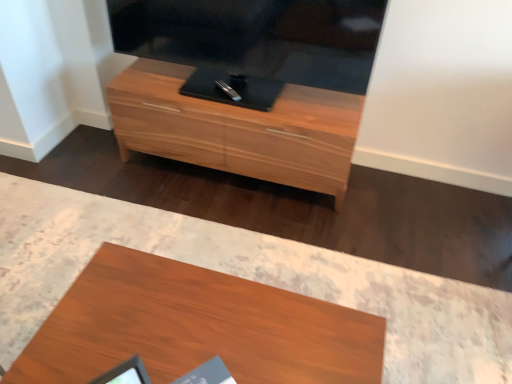
Question: Can you confirm if wooden chest of drawers at center is taller than wooden desk at center?

Choices:
 (A) yes
 (B) no

Answer: (A)

Question: Is wooden chest of drawers at center far from wooden desk at center?

Choices:
 (A) yes
 (B) no

Answer: (B)

Question: Considering the relative sizes of wooden chest of drawers at center and wooden desk at center in the image provided, is wooden chest of drawers at center wider than wooden desk at center?

Choices:
 (A) yes
 (B) no

Answer: (B)

Question: Could you tell me if wooden chest of drawers at center is turned towards wooden desk at center?

Choices:
 (A) no
 (B) yes

Answer: (B)

Question: Is wooden chest of drawers at center at the right side of wooden desk at center?

Choices:
 (A) no
 (B) yes

Answer: (B)

Question: Is wooden chest of drawers at center placed right next to wooden desk at center?

Choices:
 (A) no
 (B) yes

Answer: (A)

Question: Considering the relative sizes of wooden desk at center and wooden chest of drawers at center in the image provided, is wooden desk at center shorter than wooden chest of drawers at center?

Choices:
 (A) yes
 (B) no

Answer: (A)

Question: Can you confirm if wooden desk at center is taller than wooden chest of drawers at center?

Choices:
 (A) no
 (B) yes

Answer: (A)

Question: Is wooden desk at center behind wooden chest of drawers at center?

Choices:
 (A) no
 (B) yes

Answer: (A)

Question: Is wooden desk at center at the left side of wooden chest of drawers at center?

Choices:
 (A) yes
 (B) no

Answer: (A)

Question: Considering the relative sizes of wooden desk at center and wooden chest of drawers at center in the image provided, is wooden desk at center smaller than wooden chest of drawers at center?

Choices:
 (A) yes
 (B) no

Answer: (A)

Question: Is wooden desk at center in front of wooden chest of drawers at center?

Choices:
 (A) yes
 (B) no

Answer: (A)

Question: In terms of width, does wooden desk at center look wider or thinner when compared to wooden chest of drawers at center?

Choices:
 (A) thin
 (B) wide

Answer: (B)